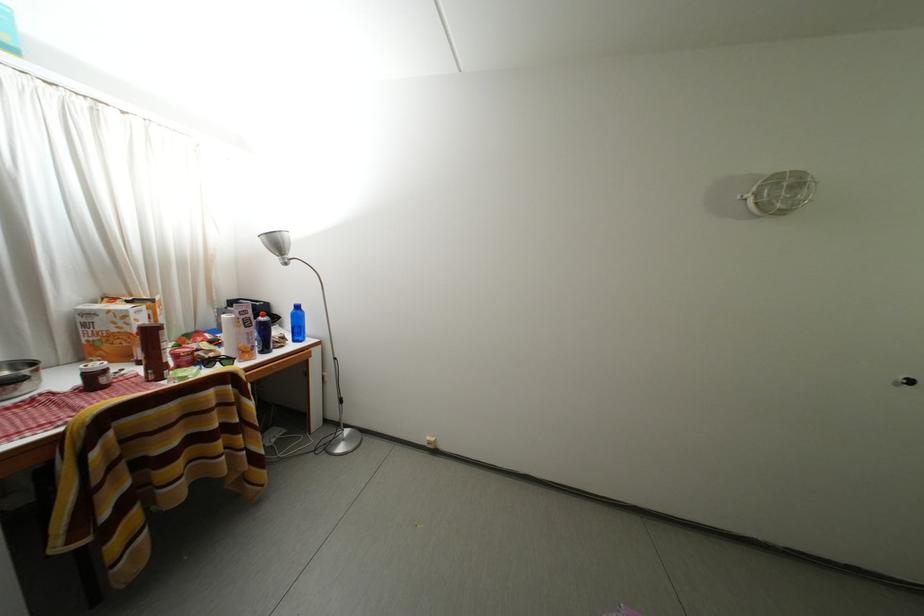
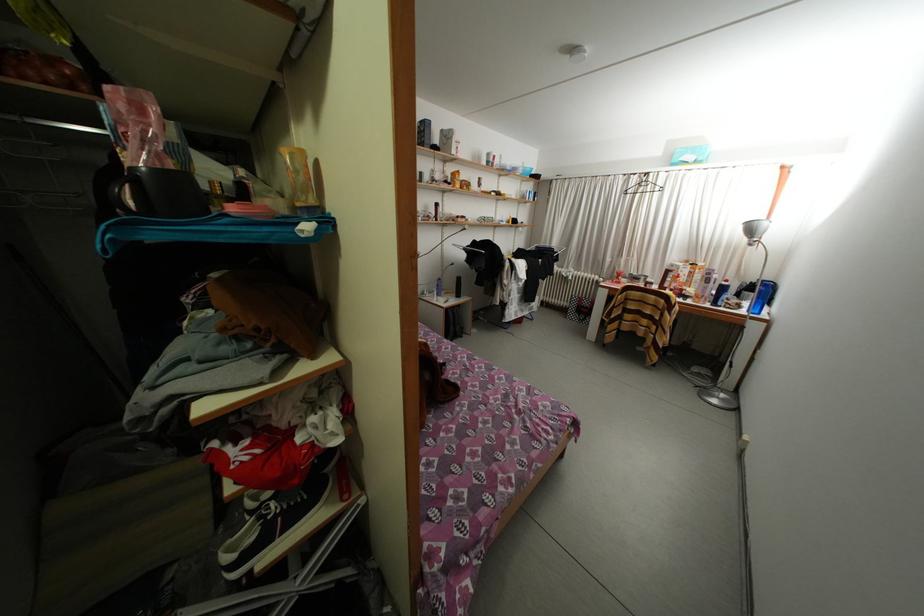
Question: I am providing you with two images of the same scene from different viewpoints. Please identify which objects are invisible in image2.

Choices:
 (A) black spray can
 (B) blue spray bottle
 (C) silver lamp head
 (D) none of these

Answer: (D)